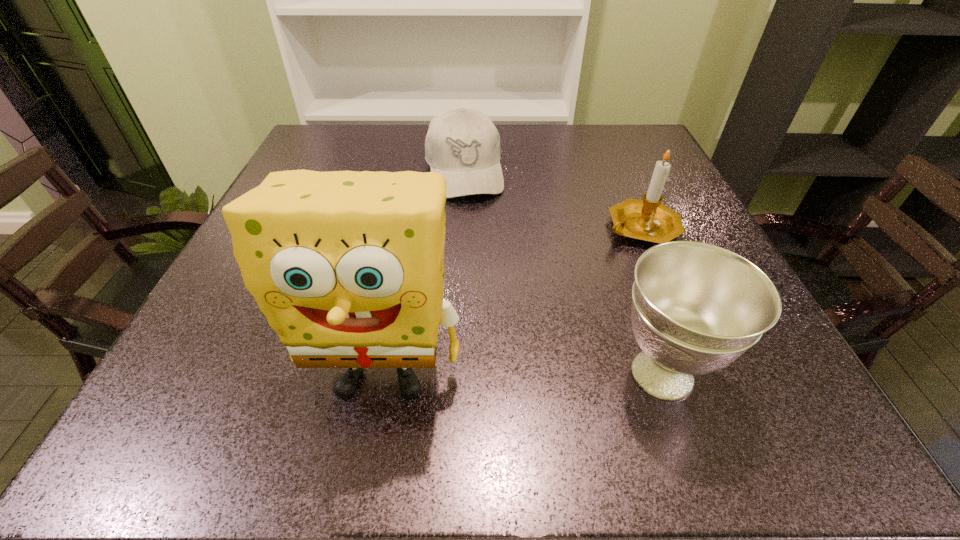
Find the location of a particular element. free spot at the near left corner of the desktop is located at coordinates (244, 337).

Find the location of `vacant region at the far right corner`. vacant region at the far right corner is located at coordinates (661, 160).

This screenshot has height=540, width=960. I want to click on vacant space that is in between the chalice and the sponge, so click(x=522, y=374).

Find the location of a particular element. The height and width of the screenshot is (540, 960). free space that is in between the candle holder and the tallest object is located at coordinates (512, 301).

Identify the location of vacant region between the chalice and the tallest object. The width and height of the screenshot is (960, 540). (522, 374).

Locate an element on the screen. Image resolution: width=960 pixels, height=540 pixels. free space between the chalice and the tallest object is located at coordinates (522, 374).

Locate an element on the screen. free point between the baseball cap and the chalice is located at coordinates (563, 273).

This screenshot has width=960, height=540. Find the location of `free spot between the chalice and the baseball cap`. free spot between the chalice and the baseball cap is located at coordinates pyautogui.click(x=563, y=273).

The height and width of the screenshot is (540, 960). I want to click on vacant area that lies between the baseball cap and the candle holder, so click(553, 199).

Locate an element on the screen. vacant space that's between the third nearest object and the tallest object is located at coordinates (512, 301).